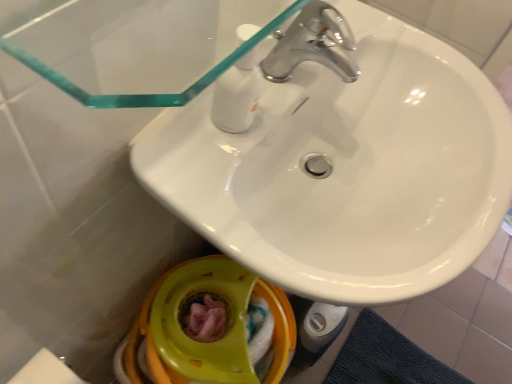
Question: In which direction should I rotate to look at chrome metallic faucet at upper center, the second tap from the top?

Choices:
 (A) left
 (B) right

Answer: (B)

Question: Can you confirm if matte yellow plastic toilet bowl at lower center is thinner than chrome metallic faucet at upper center, the second tap from the top?

Choices:
 (A) yes
 (B) no

Answer: (B)

Question: Is matte yellow plastic toilet bowl at lower center outside of chrome metallic faucet at upper center, which is the first tap from bottom to top?

Choices:
 (A) yes
 (B) no

Answer: (A)

Question: Is matte yellow plastic toilet bowl at lower center with chrome metallic faucet at upper center, the second tap from the top?

Choices:
 (A) yes
 (B) no

Answer: (B)

Question: Does matte yellow plastic toilet bowl at lower center lie in front of chrome metallic faucet at upper center, the second tap from the top?

Choices:
 (A) no
 (B) yes

Answer: (A)

Question: From a real-world perspective, is matte yellow plastic toilet bowl at lower center located higher than chrome metallic faucet at upper center, which is the first tap from bottom to top?

Choices:
 (A) no
 (B) yes

Answer: (A)

Question: Can you confirm if matte yellow plastic toilet bowl at lower center is taller than chrome metallic faucet at upper center, the second tap from the top?

Choices:
 (A) yes
 (B) no

Answer: (A)

Question: Can we say chrome metallic faucet at upper center, arranged as the 2th tap when ordered from the bottom, lies outside white glossy sink at upper center?

Choices:
 (A) yes
 (B) no

Answer: (A)

Question: Are chrome metallic faucet at upper center, arranged as the 2th tap when ordered from the bottom, and white glossy sink at upper center far apart?

Choices:
 (A) yes
 (B) no

Answer: (B)

Question: Can you confirm if chrome metallic faucet at upper center, the 1th tap viewed from the top, is wider than white glossy sink at upper center?

Choices:
 (A) no
 (B) yes

Answer: (A)

Question: Is white glossy sink at upper center surrounded by chrome metallic faucet at upper center, the 1th tap viewed from the top?

Choices:
 (A) yes
 (B) no

Answer: (B)

Question: Does chrome metallic faucet at upper center, the 1th tap viewed from the top, have a larger size compared to white glossy sink at upper center?

Choices:
 (A) no
 (B) yes

Answer: (A)

Question: From the image's perspective, is chrome metallic faucet at upper center, the 1th tap viewed from the top, on white glossy sink at upper center?

Choices:
 (A) yes
 (B) no

Answer: (A)

Question: Is the position of chrome metallic faucet at upper center, the 1th tap viewed from the top, less distant than that of chrome metallic faucet at upper center, the second tap from the top?

Choices:
 (A) no
 (B) yes

Answer: (A)